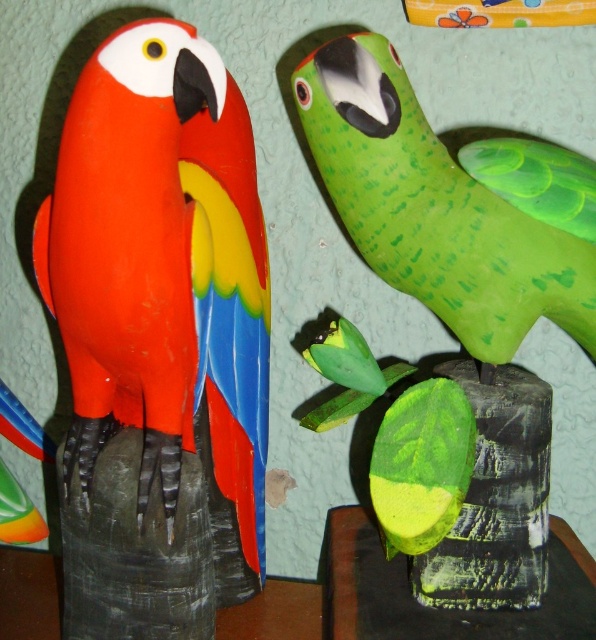
Which is in front, point (229, 301) or point (408, 157)?

Point (408, 157) is in front.

Can you confirm if matte plastic parrot at left is positioned above green matte parrot at upper right?

No, matte plastic parrot at left is not above green matte parrot at upper right.

Describe the element at coordinates (163, 256) in the screenshot. Image resolution: width=596 pixels, height=640 pixels. I see `matte plastic parrot at left` at that location.

This screenshot has height=640, width=596. In order to click on matte plastic parrot at left in this screenshot , I will do `click(163, 256)`.